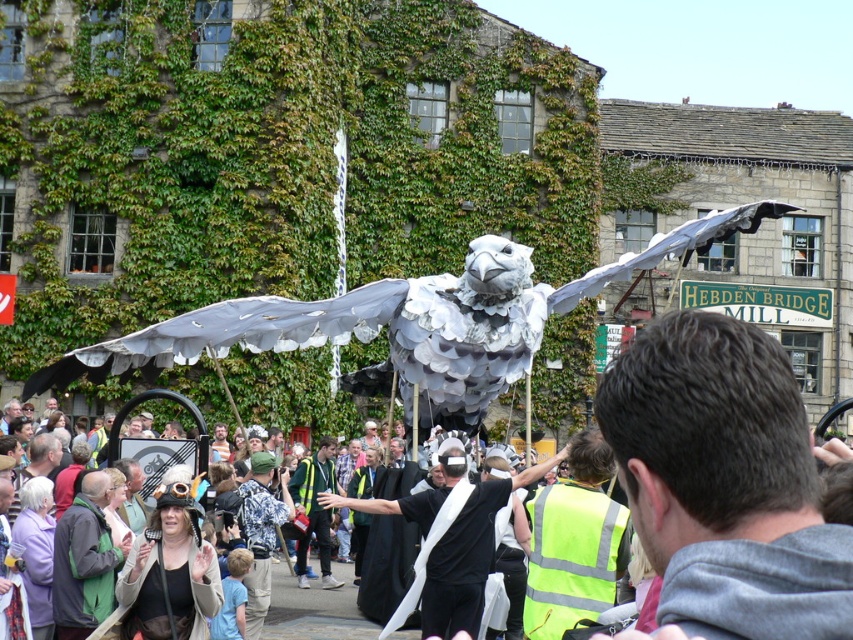
Question: Which of the following is the closest to the observer?

Choices:
 (A) (303, 481)
 (B) (612, 506)
 (C) (440, 509)
 (D) (846, 544)

Answer: (D)

Question: In this image, where is silver metallic eagle at center located relative to reflective silver jacket at center?

Choices:
 (A) right
 (B) left

Answer: (A)

Question: Which of the following is the closest to the observer?

Choices:
 (A) reflective silver jacket at center
 (B) high-visibility yellow vest at center
 (C) white paper bird at center
 (D) silver metallic eagle at center

Answer: (B)

Question: Can you confirm if dark gray hair at center is positioned to the right of high-visibility yellow vest at center?

Choices:
 (A) no
 (B) yes

Answer: (B)

Question: Which point appears farthest from the camera in this image?

Choices:
 (A) (688, 435)
 (B) (602, 278)

Answer: (B)

Question: From the image, what is the correct spatial relationship of white paper bird at center in relation to reflective silver jacket at center?

Choices:
 (A) right
 (B) left

Answer: (A)